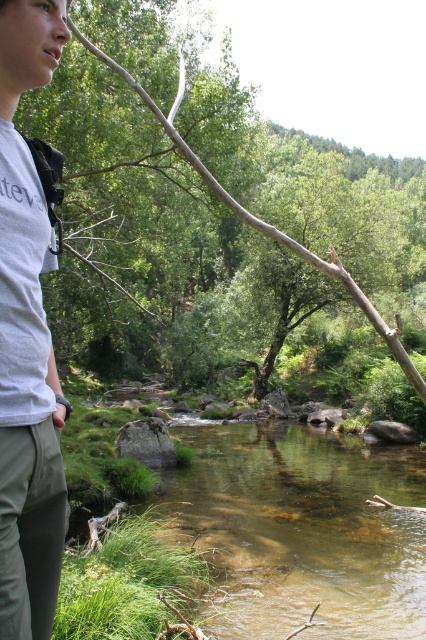
You are a hiker who wants to take a photo of the smooth brown branch at upper center. You are currently standing near the white cotton shirt at left. Which direction should you move to get a better view of the branch?

The smooth brown branch at upper center is larger than the white cotton shirt at left, so you should move to the right to get a better view of the branch.

You are a hiker who wants to cross the stream. The stream is flowing from the top to the bottom of the image. You are standing on the left bank of the clear water at center. Which direction should you walk to cross the stream safely?

Since the stream flows from the top to the bottom of the image, the safest path to cross would be perpendicular to the flow. Therefore, you should walk towards the right bank directly across from your current position on the left bank of the clear water at center to cross safely.